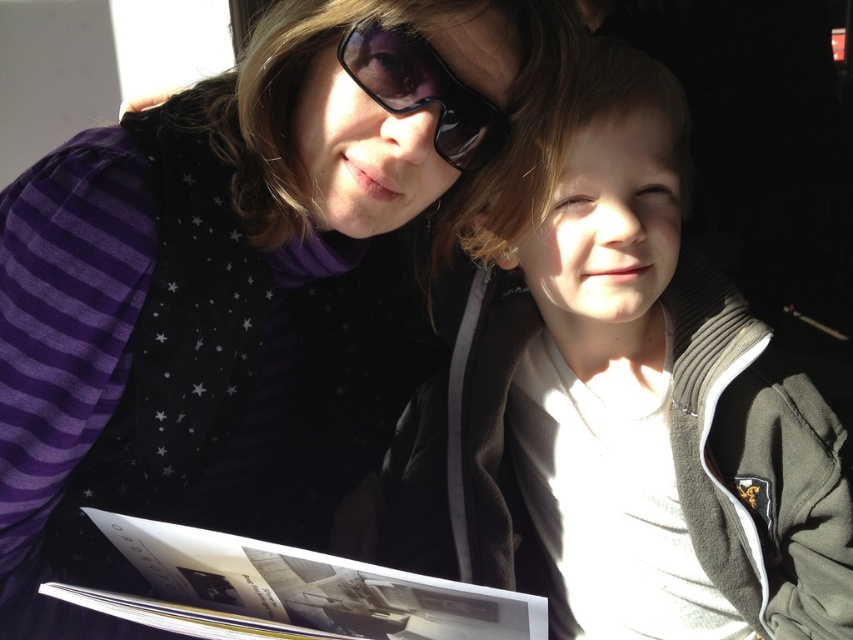
Based on the scene description, can you determine the spatial relationship between the light brown hair at center and the matte black sunglasses at upper center?

The light brown hair at center is located below the matte black sunglasses at upper center.